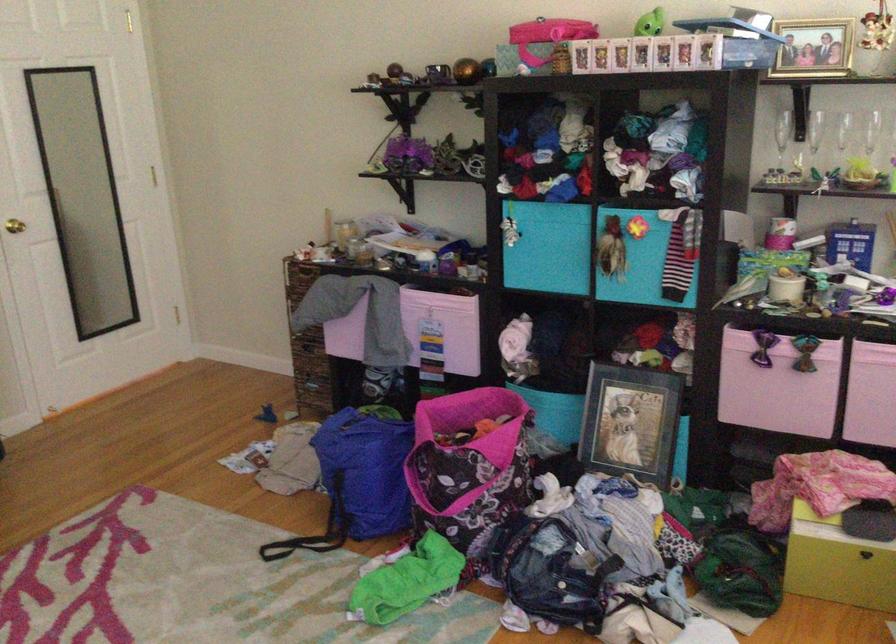
The width and height of the screenshot is (896, 644). What do you see at coordinates (440, 498) in the screenshot? I see `the pink fabric handle` at bounding box center [440, 498].